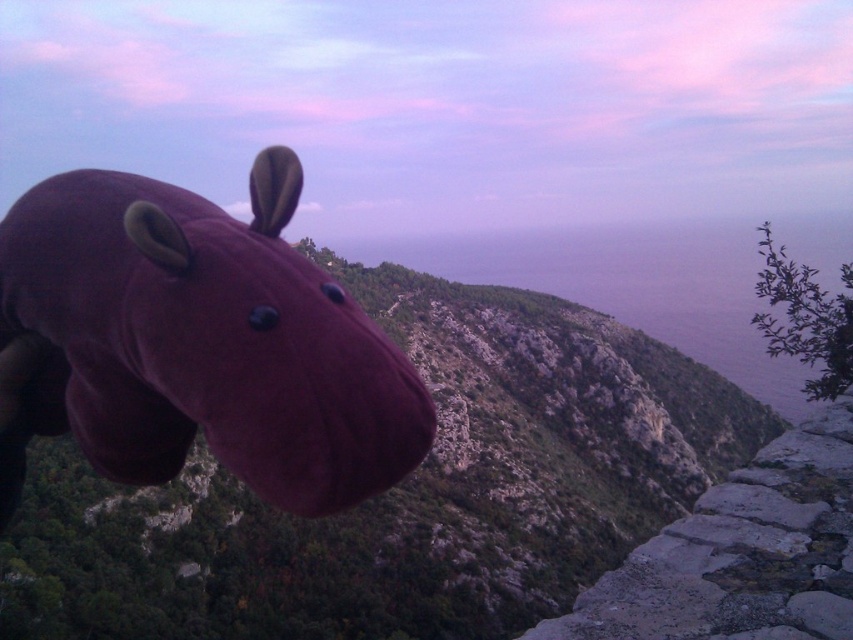
The height and width of the screenshot is (640, 853). Describe the element at coordinates (401, 490) in the screenshot. I see `purple plush hippo at left` at that location.

Between purple plush hippo at left and velvet purple hippo at left, which one appears on the right side from the viewer's perspective?

purple plush hippo at left is more to the right.

Is point (465, 448) positioned in front of point (64, 268)?

No, it is not.

In order to click on purple plush hippo at left in this screenshot , I will do `click(401, 490)`.

Is point (341, 332) closer to camera compared to point (531, 636)?

Yes, point (341, 332) is closer to viewer.

Between point (334, 380) and point (763, 621), which one is positioned in front?

Positioned in front is point (334, 380).

Locate an element on the screen. velvet purple hippo at left is located at coordinates (196, 342).

Where is `velvet purple hippo at left`? Image resolution: width=853 pixels, height=640 pixels. velvet purple hippo at left is located at coordinates (196, 342).

Based on the photo, between purple plush hippo at left and gray stone cliff at lower right, which one appears on the left side from the viewer's perspective?

purple plush hippo at left is more to the left.

Does purple plush hippo at left have a larger size compared to gray stone cliff at lower right?

Yes, purple plush hippo at left is bigger than gray stone cliff at lower right.

This screenshot has width=853, height=640. Find the location of `purple plush hippo at left`. purple plush hippo at left is located at coordinates (401, 490).

Where is `purple plush hippo at left`? This screenshot has width=853, height=640. purple plush hippo at left is located at coordinates (401, 490).